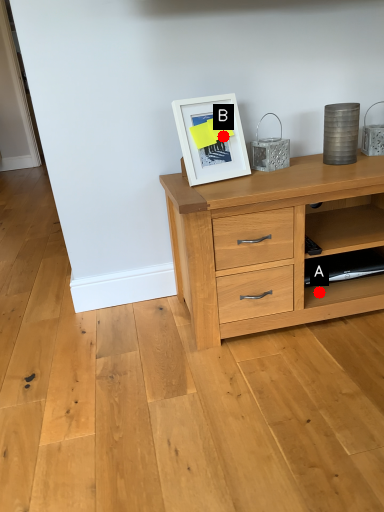
Question: Two points are circled on the image, labeled by A and B beside each circle. Which point is closer to the camera?

Choices:
 (A) A is closer
 (B) B is closer

Answer: (B)